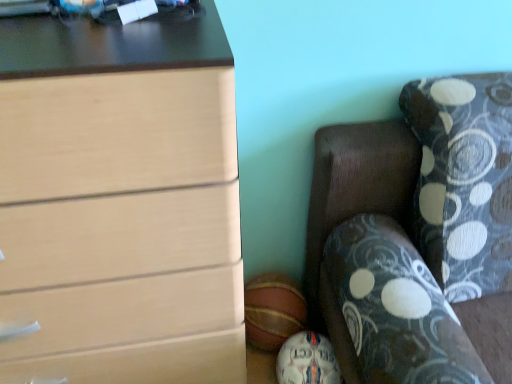
Question: Does white leather soccer ball at lower center, the 2th sports equipment viewed from the top, come in front of dark wood couch at lower right?

Choices:
 (A) yes
 (B) no

Answer: (B)

Question: Is white leather soccer ball at lower center, the 1th sports equipment when ordered from bottom to top, outside dark wood couch at lower right?

Choices:
 (A) yes
 (B) no

Answer: (B)

Question: Could you tell me if white leather soccer ball at lower center, the 2th sports equipment viewed from the top, is turned towards dark wood couch at lower right?

Choices:
 (A) yes
 (B) no

Answer: (B)

Question: Is white leather soccer ball at lower center, the 2th sports equipment viewed from the top, to the right of dark wood couch at lower right from the viewer's perspective?

Choices:
 (A) yes
 (B) no

Answer: (B)

Question: Is white leather soccer ball at lower center, the 2th sports equipment viewed from the top, wider than dark wood couch at lower right?

Choices:
 (A) yes
 (B) no

Answer: (B)

Question: Does white leather soccer ball at lower center, the 1th sports equipment when ordered from bottom to top, appear on the left side of dark wood couch at lower right?

Choices:
 (A) no
 (B) yes

Answer: (B)

Question: Is white leather soccer ball at lower center, the 1th sports equipment when ordered from bottom to top, smaller than rubber basketball at lower center, the 1th sports equipment positioned from the top?

Choices:
 (A) no
 (B) yes

Answer: (B)

Question: Is white leather soccer ball at lower center, the 1th sports equipment when ordered from bottom to top, turned away from rubber basketball at lower center, the 1th sports equipment positioned from the top?

Choices:
 (A) no
 (B) yes

Answer: (B)

Question: From the image's perspective, is white leather soccer ball at lower center, the 2th sports equipment viewed from the top, under rubber basketball at lower center, which is the 2th sports equipment from bottom to top?

Choices:
 (A) yes
 (B) no

Answer: (A)

Question: From the image's perspective, is white leather soccer ball at lower center, the 1th sports equipment when ordered from bottom to top, above rubber basketball at lower center, the 1th sports equipment positioned from the top?

Choices:
 (A) yes
 (B) no

Answer: (B)

Question: Can you confirm if white leather soccer ball at lower center, the 2th sports equipment viewed from the top, is positioned to the left of rubber basketball at lower center, the 1th sports equipment positioned from the top?

Choices:
 (A) no
 (B) yes

Answer: (A)

Question: Are white leather soccer ball at lower center, the 1th sports equipment when ordered from bottom to top, and rubber basketball at lower center, the 1th sports equipment positioned from the top, located far from each other?

Choices:
 (A) yes
 (B) no

Answer: (B)

Question: Is matte wood chest of drawers at left closer to the viewer compared to white leather soccer ball at lower center, the 2th sports equipment viewed from the top?

Choices:
 (A) no
 (B) yes

Answer: (B)